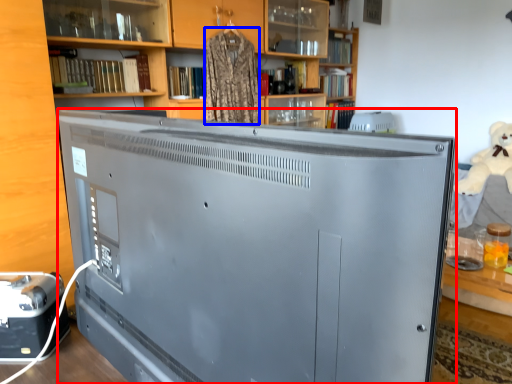
Question: Which object appears closest to the camera in this image, television (highlighted by a red box) or clothing (highlighted by a blue box)?

Choices:
 (A) television
 (B) clothing

Answer: (A)